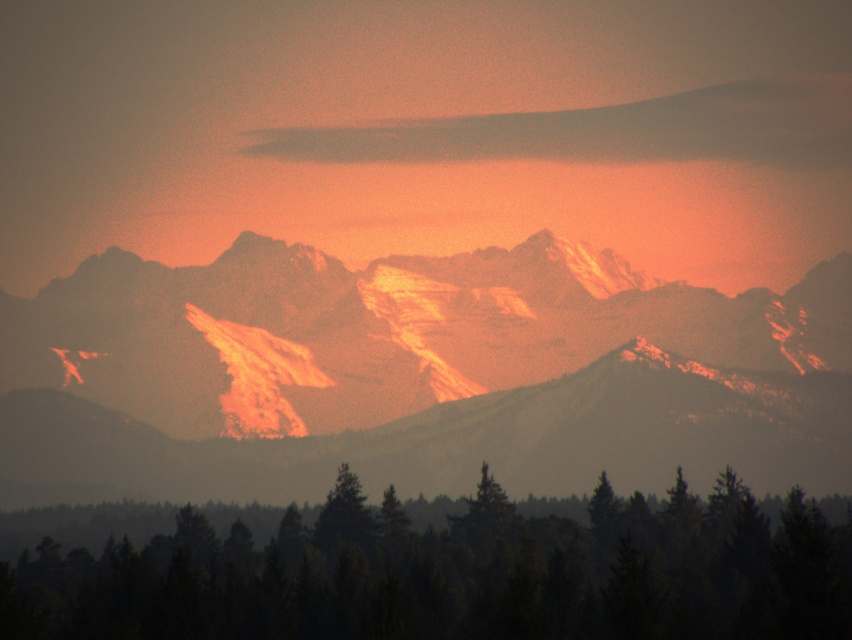
Can you confirm if green matte pine forest at lower center is positioned above green matte tree at center?

No.

Between green matte pine forest at lower center and green matte tree at center, which one appears on the left side from the viewer's perspective?

green matte tree at center

Between point (652, 621) and point (348, 538), which one is positioned behind?

Point (652, 621)

Locate an element on the screen. This screenshot has width=852, height=640. green matte pine forest at lower center is located at coordinates (x=459, y=577).

Is green matte pine forest at lower center shorter than smokey gray cloud at upper center?

No.

Who is taller, green matte pine forest at lower center or smokey gray cloud at upper center?

Standing taller between the two is green matte pine forest at lower center.

Is point (614, 582) closer to camera compared to point (406, 125)?

Yes, it is in front of point (406, 125).

The image size is (852, 640). In order to click on green matte pine forest at lower center in this screenshot , I will do (459, 577).

Who is shorter, smokey gray cloud at upper center or green matte tree at center?

Standing shorter between the two is green matte tree at center.

This screenshot has height=640, width=852. Identify the location of smokey gray cloud at upper center. (608, 131).

This screenshot has width=852, height=640. In order to click on smokey gray cloud at upper center in this screenshot , I will do `click(608, 131)`.